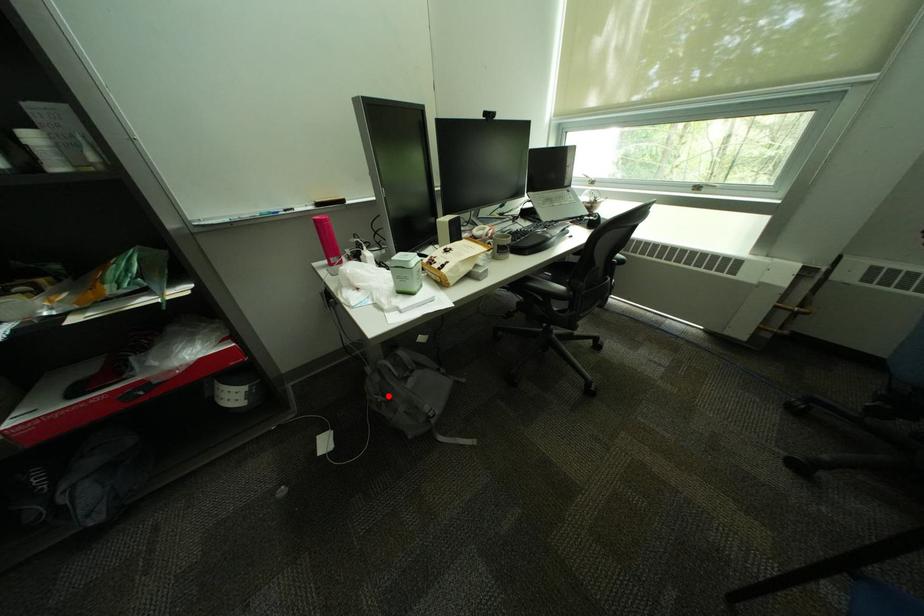
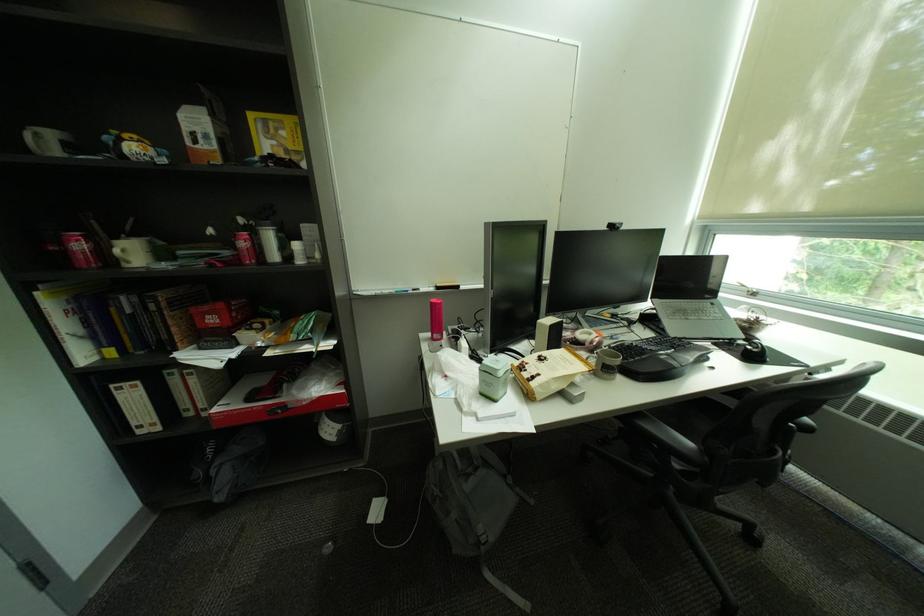
Where in the second image is the point corresponding to the highlighted location from the first image?

(446, 487)